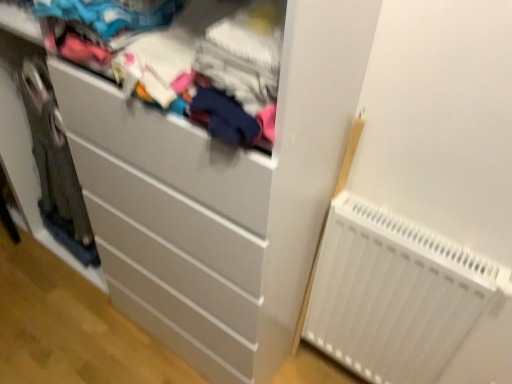
Question: Is matte fabric clothes at upper center wider than white plastic radiator at lower right?

Choices:
 (A) no
 (B) yes

Answer: (B)

Question: Is matte fabric clothes at upper center bigger than white plastic radiator at lower right?

Choices:
 (A) no
 (B) yes

Answer: (B)

Question: Can you confirm if matte fabric clothes at upper center is taller than white plastic radiator at lower right?

Choices:
 (A) yes
 (B) no

Answer: (B)

Question: From the image's perspective, is matte fabric clothes at upper center above white plastic radiator at lower right?

Choices:
 (A) no
 (B) yes

Answer: (B)

Question: Could white plastic radiator at lower right be considered to be inside matte fabric clothes at upper center?

Choices:
 (A) yes
 (B) no

Answer: (B)

Question: Is white matte chest of drawers at center wider or thinner than white plastic radiator at lower right?

Choices:
 (A) wide
 (B) thin

Answer: (A)

Question: Is white matte chest of drawers at center spatially inside white plastic radiator at lower right, or outside of it?

Choices:
 (A) inside
 (B) outside

Answer: (B)

Question: Considering the positions of white matte chest of drawers at center and white plastic radiator at lower right in the image, is white matte chest of drawers at center bigger or smaller than white plastic radiator at lower right?

Choices:
 (A) big
 (B) small

Answer: (A)

Question: From their relative heights in the image, would you say white matte chest of drawers at center is taller or shorter than white plastic radiator at lower right?

Choices:
 (A) tall
 (B) short

Answer: (A)

Question: Is point (266, 112) positioned closer to the camera than point (120, 124)?

Choices:
 (A) closer
 (B) farther

Answer: (A)

Question: In terms of width, does matte fabric clothes at upper center look wider or thinner when compared to white matte chest of drawers at center?

Choices:
 (A) thin
 (B) wide

Answer: (A)

Question: In terms of height, does matte fabric clothes at upper center look taller or shorter compared to white matte chest of drawers at center?

Choices:
 (A) short
 (B) tall

Answer: (A)

Question: Is matte fabric clothes at upper center to the left or to the right of white matte chest of drawers at center in the image?

Choices:
 (A) right
 (B) left

Answer: (A)

Question: Considering their positions, is white matte chest of drawers at center located in front of or behind matte fabric clothes at upper center?

Choices:
 (A) behind
 (B) front

Answer: (A)

Question: Does point (18, 187) appear closer or farther from the camera than point (266, 87)?

Choices:
 (A) closer
 (B) farther

Answer: (B)